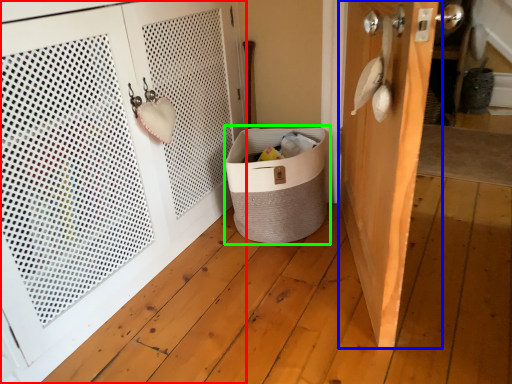
Question: Which object is positioned farthest from door (highlighted by a red box)? Select from door (highlighted by a blue box) and laundry basket (highlighted by a green box).

Choices:
 (A) door
 (B) laundry basket

Answer: (A)